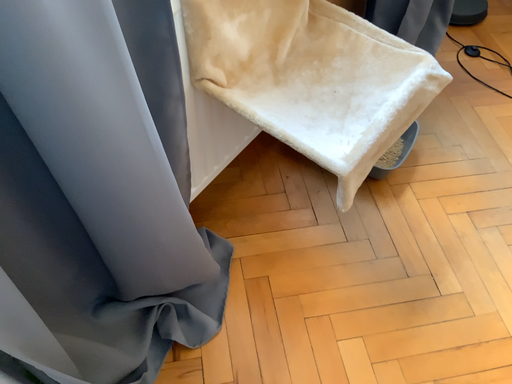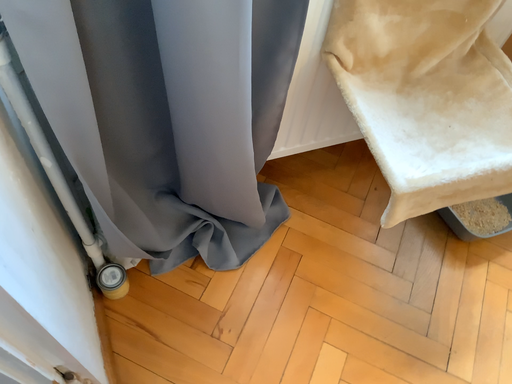
Question: Which way did the camera rotate in the video?

Choices:
 (A) rotated right
 (B) rotated left

Answer: (B)